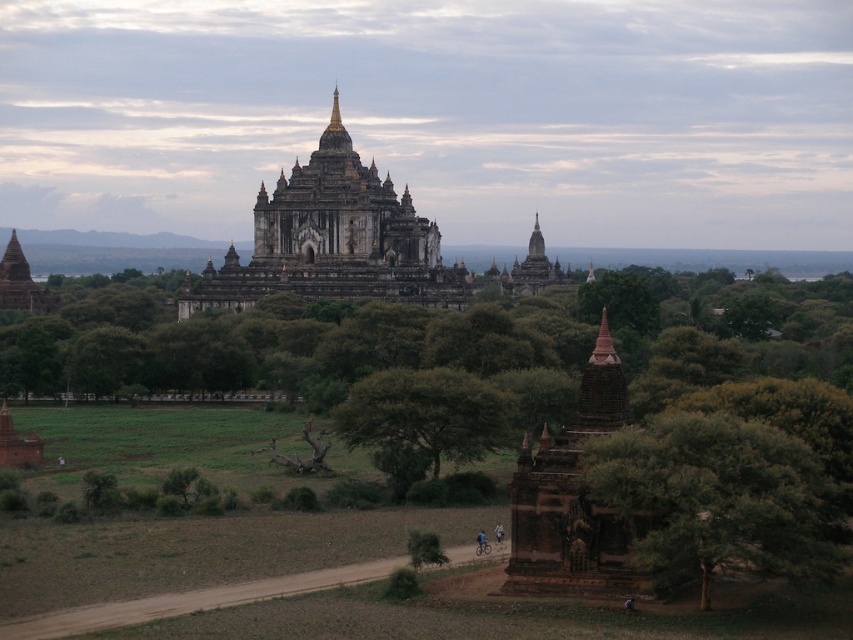
Can you confirm if green leafy tree at lower right is wider than green leafy tree at center?

Correct, the width of green leafy tree at lower right exceeds that of green leafy tree at center.

Is green leafy tree at lower right closer to the viewer compared to green leafy tree at center?

Yes, it is.

Who is more forward, (x=711, y=460) or (x=444, y=412)?

Point (x=711, y=460)

This screenshot has width=853, height=640. In order to click on green leafy tree at lower right in this screenshot , I will do `click(718, 497)`.

Is stone temple at center wider than brown stone temple at lower right?

Yes.

Which is behind, point (508, 276) or point (572, 582)?

Positioned behind is point (508, 276).

Does point (439, 260) lie in front of point (589, 524)?

That is False.

Where is `stone temple at center`? stone temple at center is located at coordinates (350, 243).

Which of these two, green leafy tree at lower right or brown stone temple at lower right, stands shorter?

green leafy tree at lower right

Locate an element on the screen. green leafy tree at lower right is located at coordinates (718, 497).

Locate an element on the screen. green leafy tree at lower right is located at coordinates (718, 497).